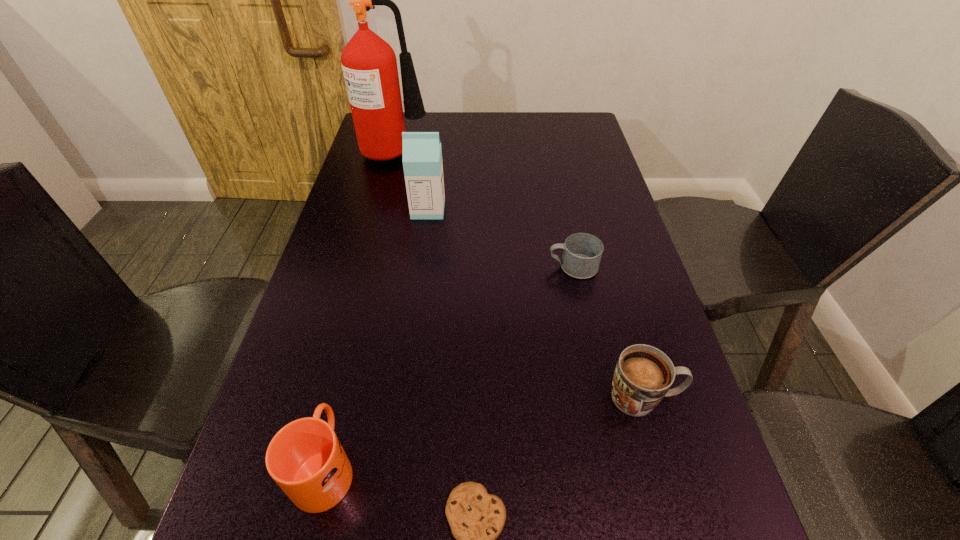
Find the location of a particular element. This screenshot has width=960, height=540. fire extinguisher is located at coordinates (369, 64).

This screenshot has height=540, width=960. I want to click on the tallest object, so click(369, 64).

Find the location of a particular element. This screenshot has height=540, width=960. the second farthest object is located at coordinates (422, 154).

What are the coordinates of `the second tallest object` in the screenshot? It's located at (422, 154).

Identify the location of the leftmost mug. The image size is (960, 540). (305, 458).

Where is `the nearest mug`? This screenshot has height=540, width=960. the nearest mug is located at coordinates (305, 458).

You are a GUI agent. You are given a task and a screenshot of the screen. Output one action in this format:
    pyautogui.click(x=<x>, y=<y>)
    Task: Click on the fourth tallest object
    
    Given the screenshot: What is the action you would take?
    pyautogui.click(x=643, y=376)

Identify the location of the third nearest object. (643, 376).

Identify the location of the fifth tallest object. (582, 252).

At what (x,y) coordinates should I click in order to perform the action: click on the shortest mug. Please return your answer as a coordinate pair (x, y). The width and height of the screenshot is (960, 540). Looking at the image, I should click on (582, 252).